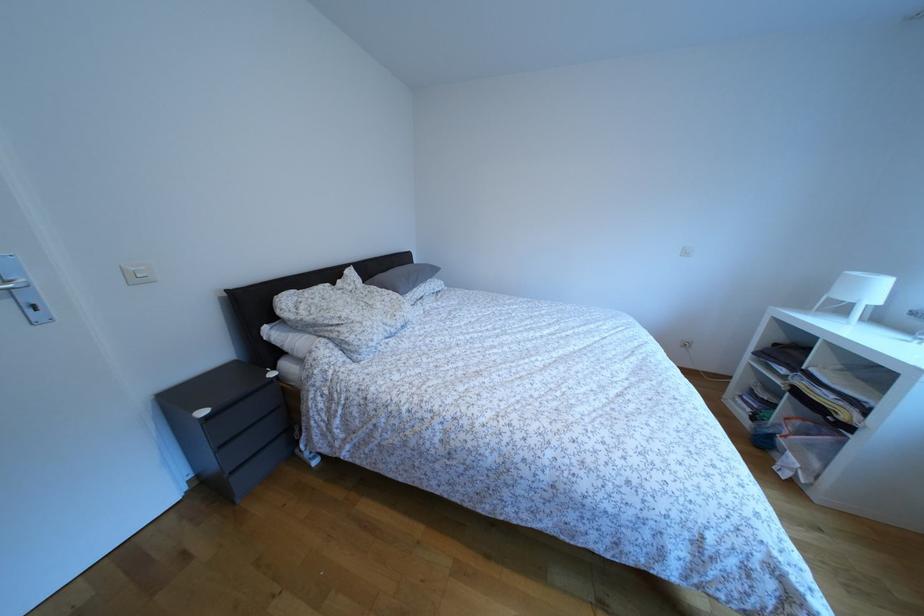
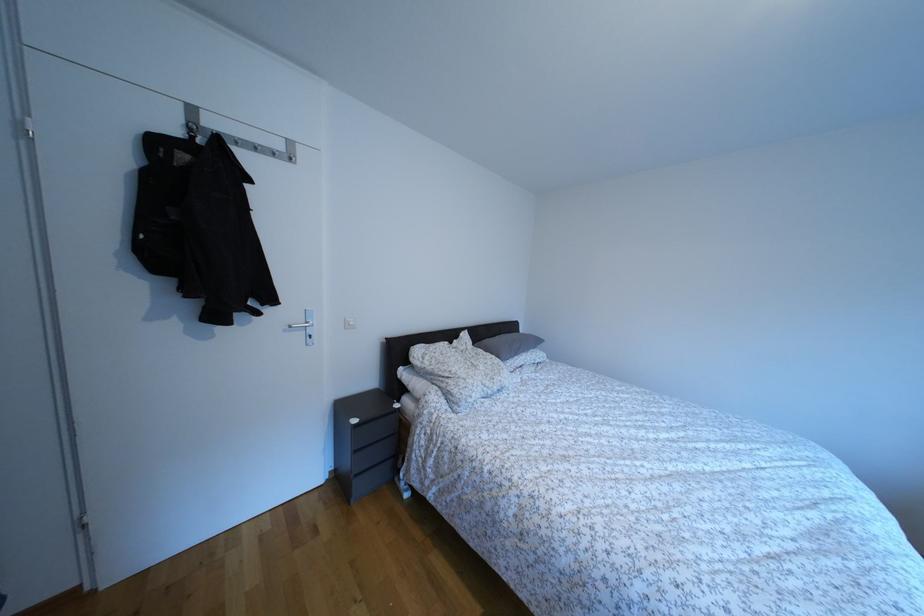
In the second image, find the point that corresponds to [422,267] in the first image.

(529, 336)